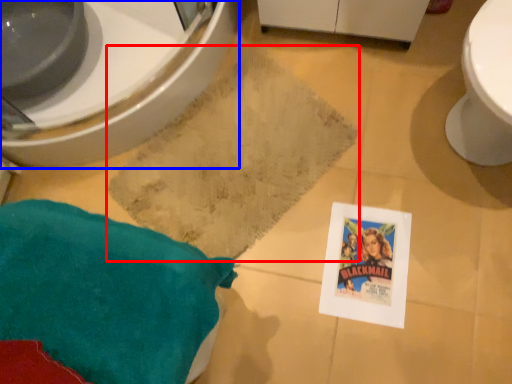
Question: Among these objects, which one is nearest to the camera, bath mat (highlighted by a red box) or bidet (highlighted by a blue box)?

Choices:
 (A) bath mat
 (B) bidet

Answer: (B)